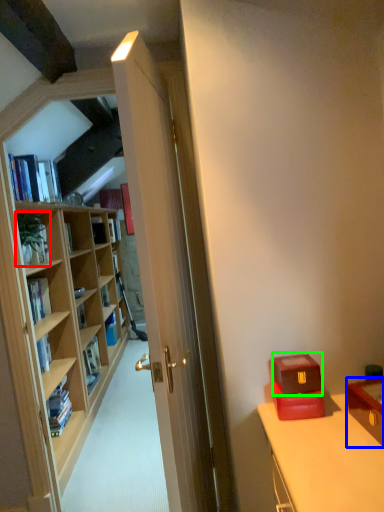
Question: Considering the real-world distances, which object is closest to houseplant (highlighted by a red box)? file cabinet (highlighted by a blue box) or box (highlighted by a green box).

Choices:
 (A) file cabinet
 (B) box

Answer: (B)